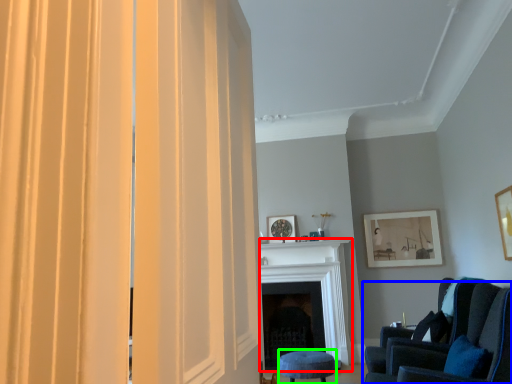
Question: Considering the real-world distances, which object is farthest from fireplace (highlighted by a red box)? chair (highlighted by a blue box) or stool (highlighted by a green box)?

Choices:
 (A) chair
 (B) stool

Answer: (A)